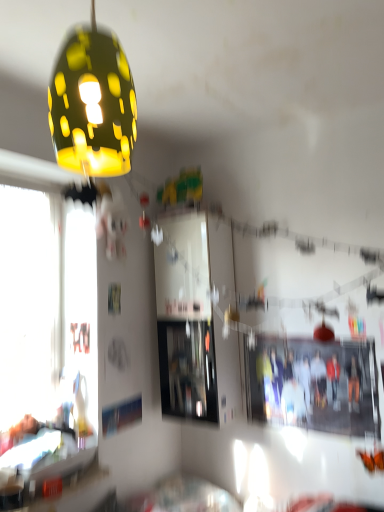
Question: Do you think matte yellow lampshade at upper left is within matte black photo at center, or outside of it?

Choices:
 (A) outside
 (B) inside

Answer: (A)

Question: Is matte yellow lampshade at upper left in front of or behind matte black photo at center in the image?

Choices:
 (A) behind
 (B) front

Answer: (B)

Question: Considering the relative positions of matte yellow lampshade at upper left and matte black photo at center in the image provided, is matte yellow lampshade at upper left to the left or to the right of matte black photo at center?

Choices:
 (A) right
 (B) left

Answer: (B)

Question: Is point (360, 420) closer or farther from the camera than point (87, 71)?

Choices:
 (A) closer
 (B) farther

Answer: (B)

Question: Is matte black photo at center in front of or behind matte yellow lampshade at upper left in the image?

Choices:
 (A) behind
 (B) front

Answer: (A)

Question: Visually, is matte black photo at center positioned to the left or to the right of matte yellow lampshade at upper left?

Choices:
 (A) left
 (B) right

Answer: (B)

Question: Considering the positions of matte black photo at center and matte yellow lampshade at upper left in the image, is matte black photo at center taller or shorter than matte yellow lampshade at upper left?

Choices:
 (A) tall
 (B) short

Answer: (A)